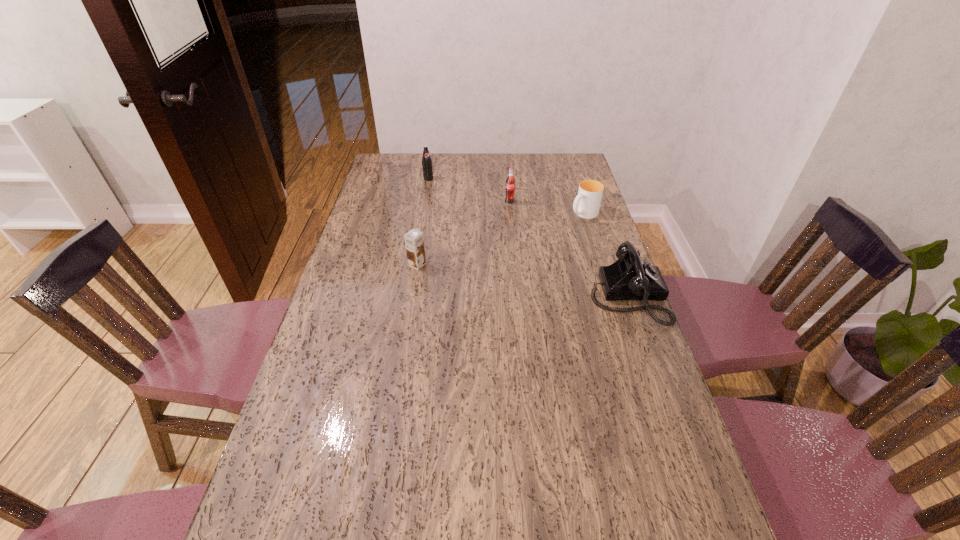
You are a GUI agent. You are given a task and a screenshot of the screen. Output one action in this format:
    pyautogui.click(x=<x>, y=<y>)
    Task: Click on the cup that is positioned at the right edge
    The height and width of the screenshot is (540, 960).
    Given the screenshot: What is the action you would take?
    pyautogui.click(x=587, y=203)

At what (x,y) coordinates should I click in order to perform the action: click on free space at the far edge of the desktop. Please return your answer as a coordinate pair (x, y). The width and height of the screenshot is (960, 540). Looking at the image, I should click on (526, 158).

The image size is (960, 540). Identify the location of free space at the left edge of the desktop. (353, 410).

Locate an element on the screen. This screenshot has width=960, height=540. free space at the right edge of the desktop is located at coordinates (583, 318).

Locate an element on the screen. The height and width of the screenshot is (540, 960). vacant space at the far left corner is located at coordinates (404, 156).

You are a GUI agent. You are given a task and a screenshot of the screen. Output one action in this format:
    pyautogui.click(x=<x>, y=<y>)
    Task: Click on the free space at the near right corner of the desktop
    The height and width of the screenshot is (540, 960).
    Given the screenshot: What is the action you would take?
    pyautogui.click(x=670, y=510)

You are a GUI agent. You are given a task and a screenshot of the screen. Output one action in this format:
    pyautogui.click(x=<x>, y=<y>)
    Task: Click on the vacant point located between the shortest object and the second farthest object
    The image size is (960, 540).
    Given the screenshot: What is the action you would take?
    pyautogui.click(x=547, y=208)

The height and width of the screenshot is (540, 960). I want to click on free point between the chocolate milk and the telephone, so click(x=522, y=280).

This screenshot has width=960, height=540. I want to click on vacant area between the fourth nearest object and the farther pop, so click(468, 191).

You are a GUI agent. You are given a task and a screenshot of the screen. Output one action in this format:
    pyautogui.click(x=<x>, y=<y>)
    Task: Click on the blank region between the farthest object and the telephone
    This screenshot has width=960, height=540.
    Given the screenshot: What is the action you would take?
    pyautogui.click(x=528, y=237)